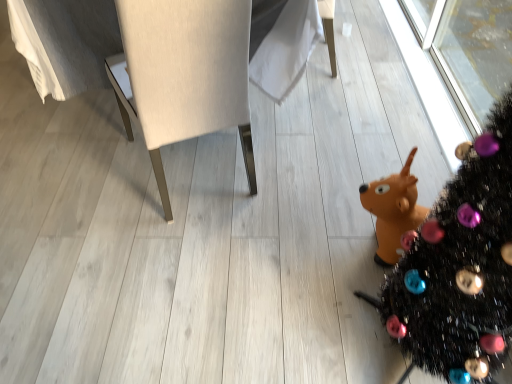
The image size is (512, 384). Identify the location of free space in front of matte white chair at center. (145, 273).